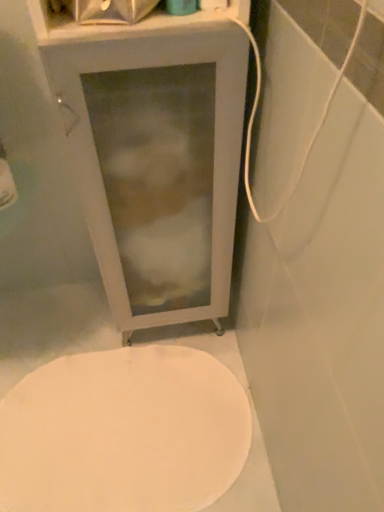
What is the approximate height of white matte toilet at lower center?

white matte toilet at lower center is 1.13 inches tall.

Describe the element at coordinates (123, 433) in the screenshot. I see `white matte toilet at lower center` at that location.

At what (x,y) coordinates should I click in order to perform the action: click on white matte toilet at lower center. Please return your answer as a coordinate pair (x, y). Looking at the image, I should click on (123, 433).

Identify the location of white matte toilet at lower center. The width and height of the screenshot is (384, 512). (123, 433).